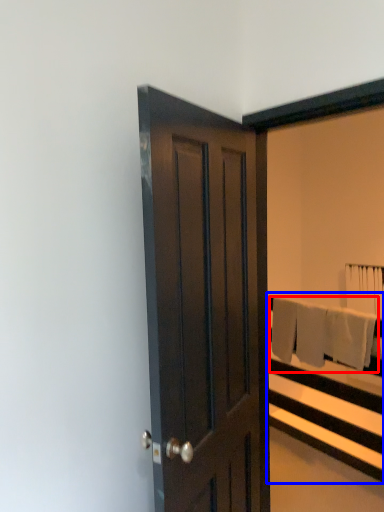
Question: Which point is further to the camera, bath towel (highlighted by a red box) or bed frame (highlighted by a blue box)?

Choices:
 (A) bath towel
 (B) bed frame

Answer: (A)